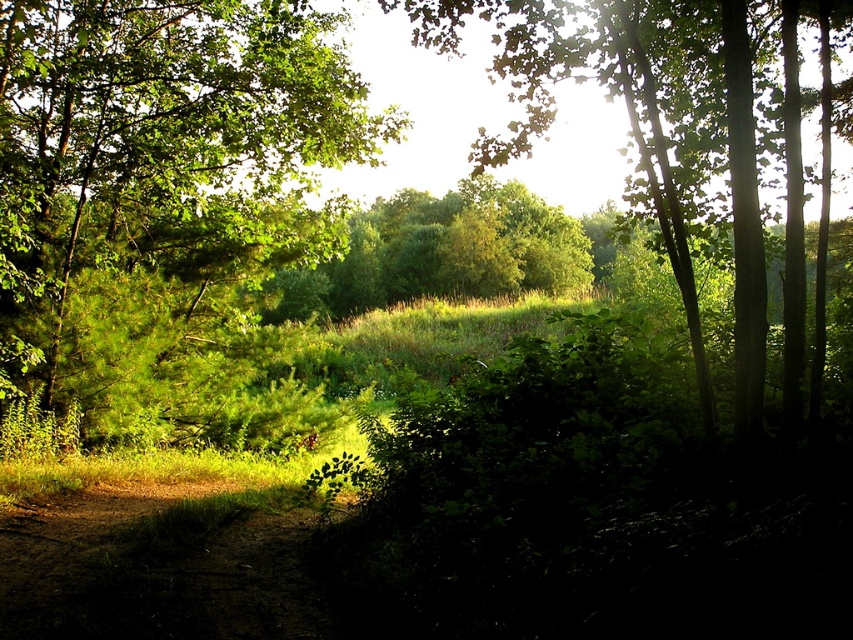
You are standing in the center of the forest scene. You want to walk towards the green leafy tree at left. In which direction should you move?

You should move to the left to reach the green leafy tree at left since it is located at point (167,209), which is to the left of the center position.

You are standing in the forest scene described. There is a point marked at coordinates (672, 140). Which object in the scene is located at this point?

The point at coordinates (672, 140) corresponds to the green leafy tree at center.

You are a hiker trying to find the shortest path to the trailhead. You see a green leafy tree at center and a brown dirt trail at lower left. Which object should you head towards to reach the trailhead?

The brown dirt trail at lower left is the path leading to the trailhead, so you should head towards the brown dirt trail at lower left.